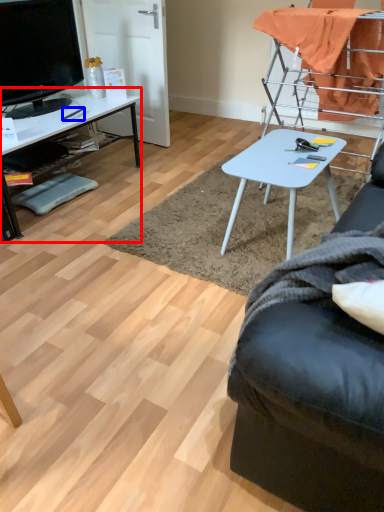
Question: Which of the following is the closest to the observer, desk (highlighted by a red box) or pen (highlighted by a blue box)?

Choices:
 (A) desk
 (B) pen

Answer: (A)